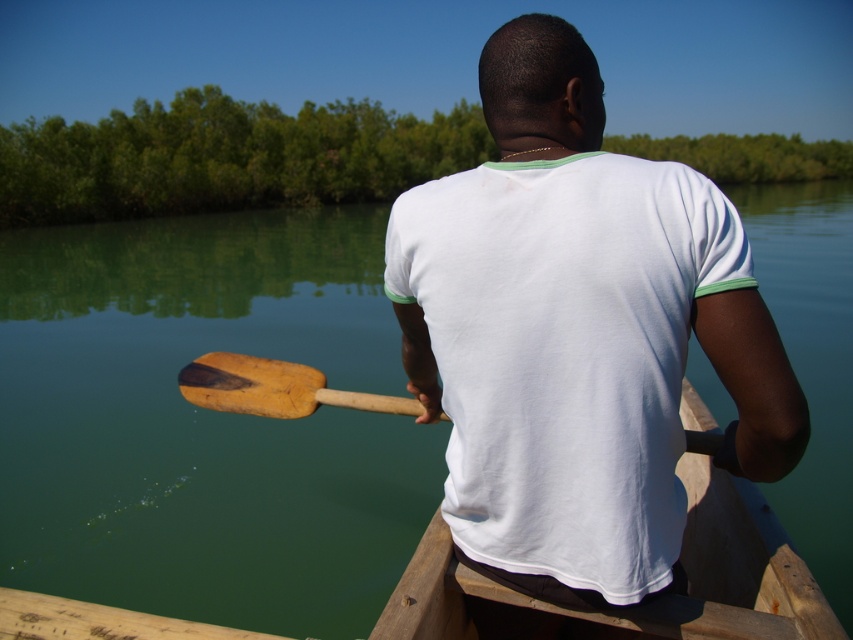
I want to click on green smooth water at center, so click(x=206, y=420).

Does point (251, 330) come closer to viewer compared to point (769, 604)?

That is False.

Describe the element at coordinates (206, 420) in the screenshot. I see `green smooth water at center` at that location.

Find the location of a particular element. This screenshot has width=853, height=640. green smooth water at center is located at coordinates (206, 420).

Which is below, wooden canoe at center or wooden paddle at center?

wooden canoe at center

Is point (445, 572) closer to viewer compared to point (247, 384)?

That is True.

Between point (634, 628) and point (265, 396), which one is positioned in front?

Point (634, 628)

This screenshot has width=853, height=640. I want to click on wooden canoe at center, so click(x=653, y=602).

Can you confirm if white cotton shirt at center is taller than wooden paddle at center?

Yes.

Can you confirm if white cotton shirt at center is positioned to the left of wooden paddle at center?

No, white cotton shirt at center is not to the left of wooden paddle at center.

Where is `white cotton shirt at center`? Image resolution: width=853 pixels, height=640 pixels. white cotton shirt at center is located at coordinates (577, 333).